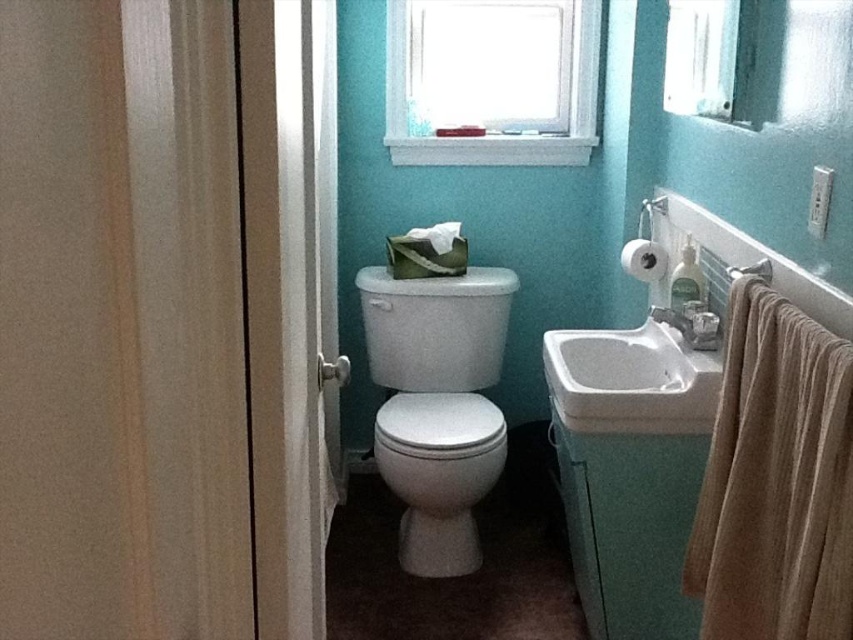
You are trying to place a new decorative item on the bathroom counter between the white glossy sink at center and the metallic silver towel bar at right. The decorative item is 20 cm wide. Can it fit in the space between them?

The white glossy sink at center might be wider than metallic silver towel bar at right, so the space between them may not be sufficient to accommodate a 20 cm wide decorative item. Check the exact dimensions before placing it.

In the scene shown: You are standing in the bathroom and want to locate the white glossy toilet bowl at center. According to the coordinates provided, where would you look?

You should look at point 0.742 on the x axis and 0.516 on the y axis to locate the white glossy toilet bowl at center.

You are a home inspector assessing bathroom dimensions. You need to determine if the white glossy toilet bowl at center can fit through the clear glass window at upper right if the window is removed. Can it based on their widths?

The white glossy toilet bowl at center might be wider than clear glass window at upper right, so it may not fit through the window if removed.